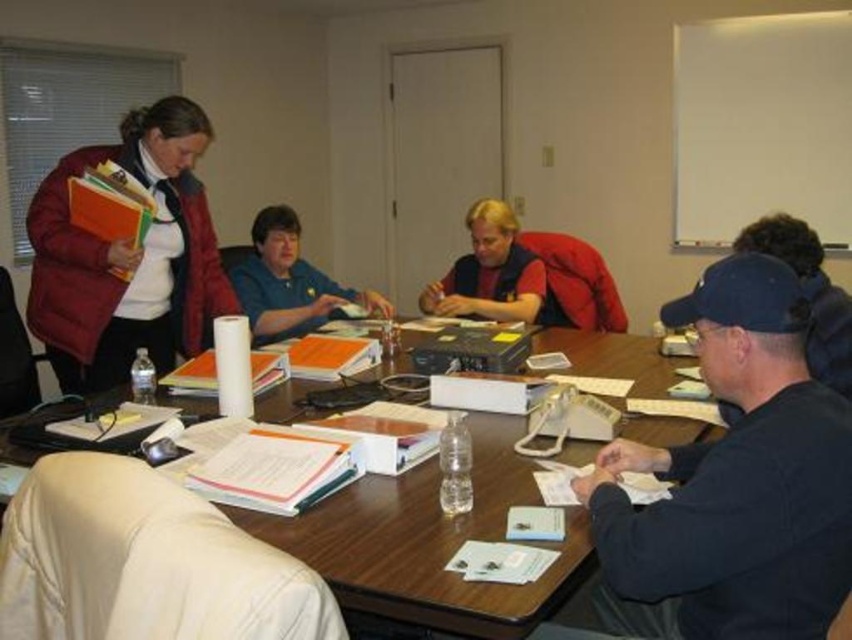
Who is higher up, white leather chair at lower left or black cap at upper right?

black cap at upper right

Who is shorter, white leather chair at lower left or black cap at upper right?

With less height is white leather chair at lower left.

Who is more forward, [256,538] or [832,368]?

Point [256,538]

You are a GUI agent. You are given a task and a screenshot of the screen. Output one action in this format:
    pyautogui.click(x=<x>, y=<y>)
    Task: Click on the white leather chair at lower left
    This screenshot has width=852, height=640.
    Given the screenshot: What is the action you would take?
    point(144,563)

Is point (383, 492) in front of point (263, 314)?

Yes, point (383, 492) is in front of point (263, 314).

This screenshot has height=640, width=852. What are the coordinates of `wooden table at center` in the screenshot? It's located at (429, 544).

Does point (448, 605) come closer to viewer compared to point (142, 164)?

Yes, it is.

Can you confirm if wooden table at center is wider than matte red jacket at left?

Yes, wooden table at center is wider than matte red jacket at left.

Who is more forward, (632, 362) or (168, 148)?

Point (168, 148) is in front.

The image size is (852, 640). I want to click on wooden table at center, so click(x=429, y=544).